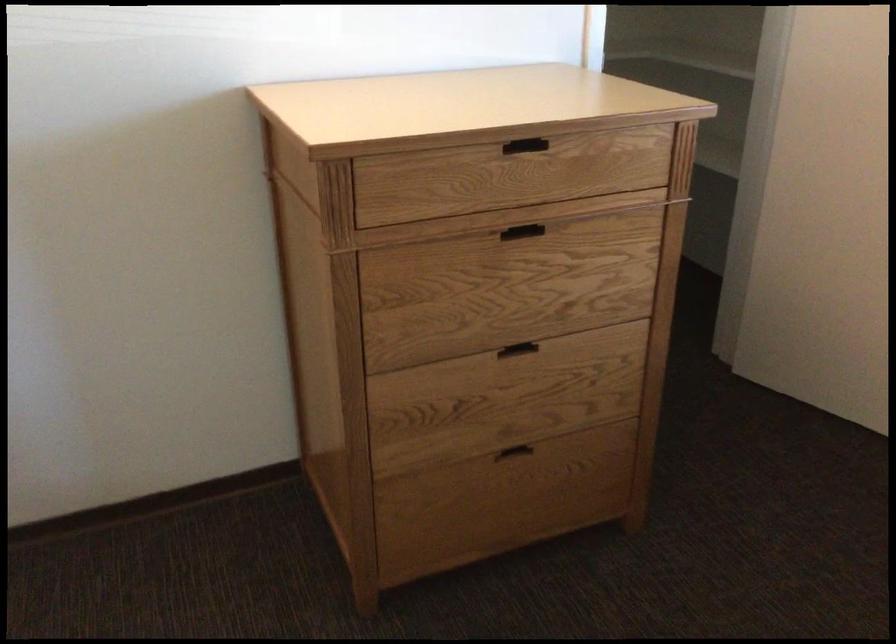
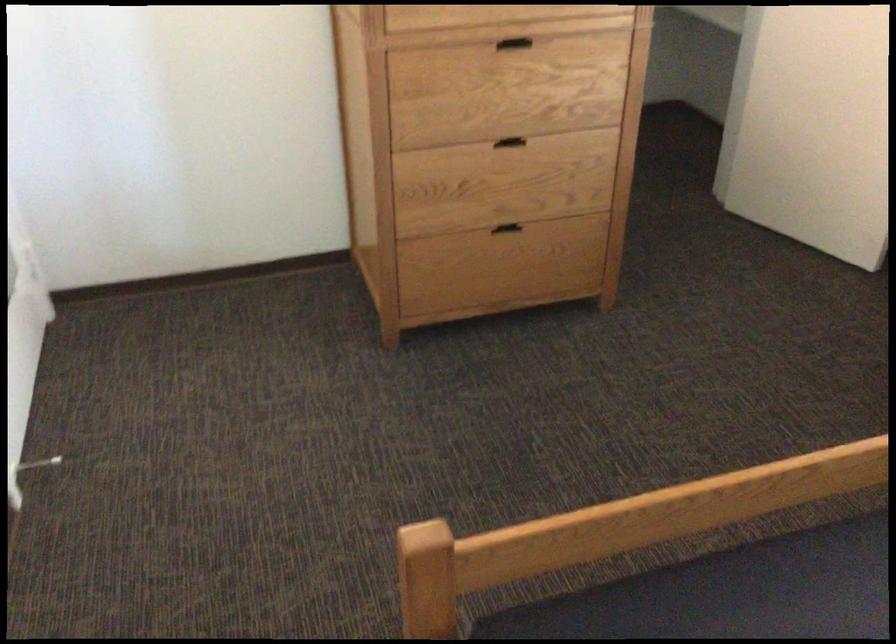
The point at (520, 464) is marked in the first image. Where is the corresponding point in the second image?

(510, 236)